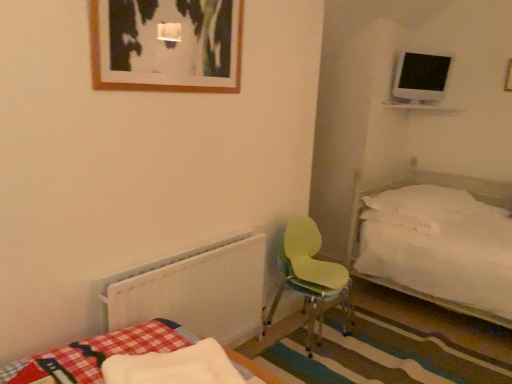
Find the location of `free spot below light green plastic chair at center (from a real-world perspective)`. free spot below light green plastic chair at center (from a real-world perspective) is located at coordinates (320, 340).